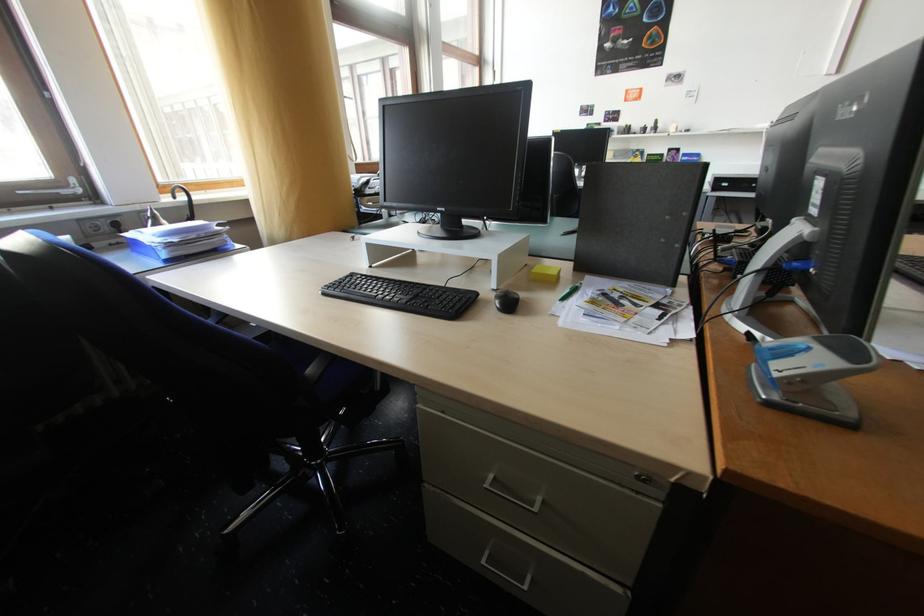
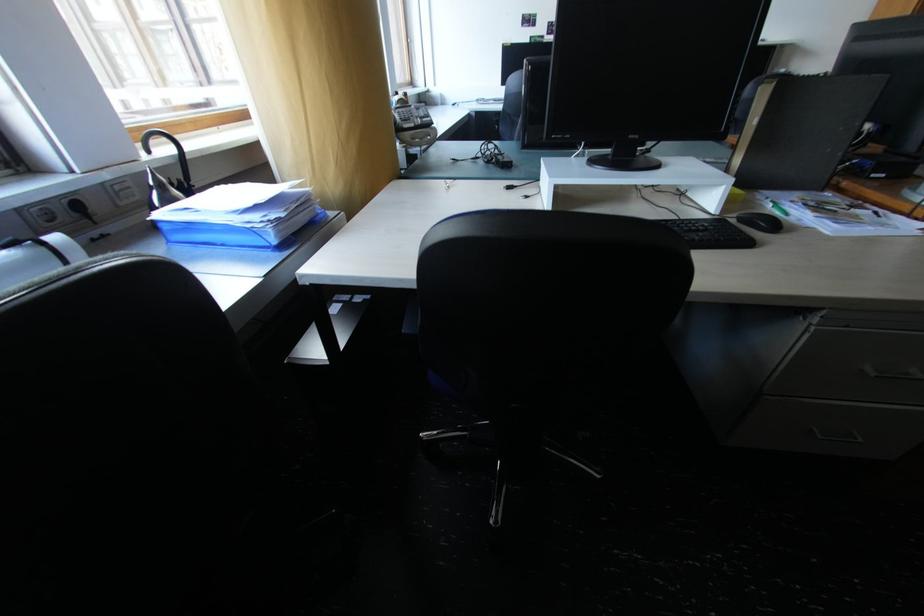
Find the pixel in the second image that matches [184,241] in the first image.

(290, 216)